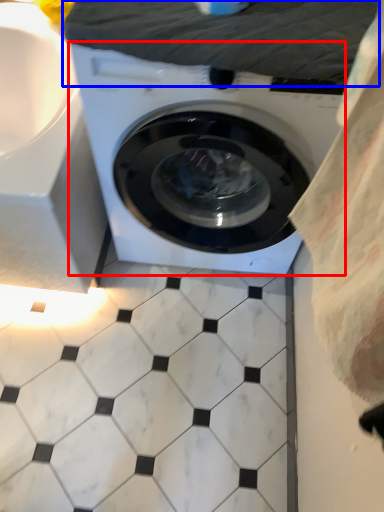
Question: Which point is closer to the camera, washing machine (highlighted by a red box) or sheet (highlighted by a blue box)?

Choices:
 (A) washing machine
 (B) sheet

Answer: (A)